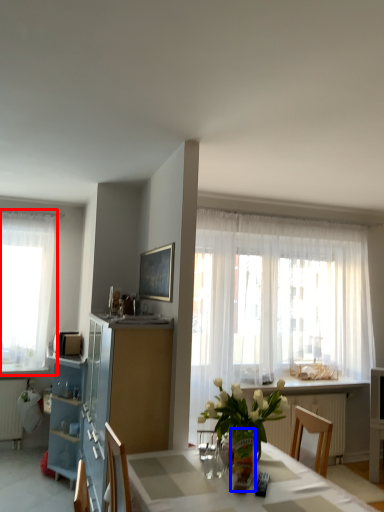
Question: Among these objects, which one is nearest to the camera, curtain (highlighted by a red box) or vase (highlighted by a blue box)?

Choices:
 (A) curtain
 (B) vase

Answer: (B)